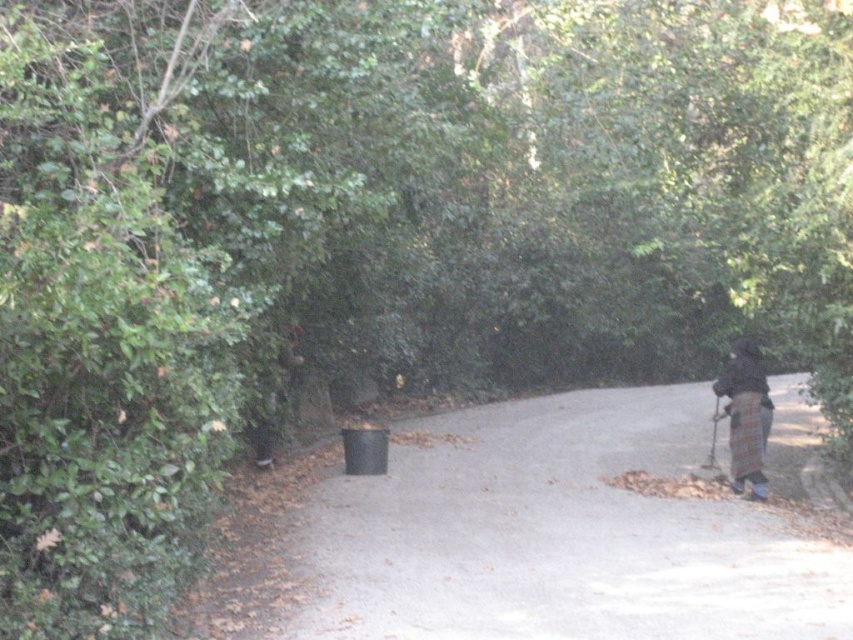
Is black plastic trash can at left thinner than plaid fabric coat at right?

In fact, black plastic trash can at left might be wider than plaid fabric coat at right.

Which is behind, point (622, 612) or point (732, 470)?

Positioned behind is point (732, 470).

I want to click on black plastic trash can at left, so click(523, 538).